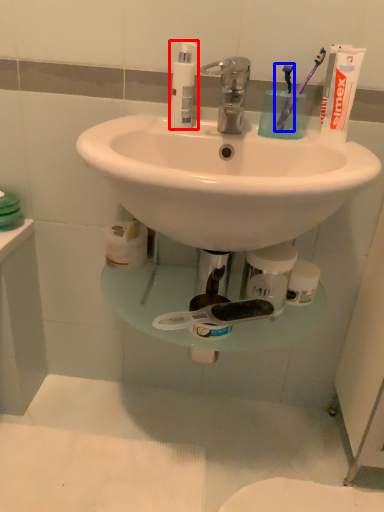
Question: Which object appears farthest to the camera in this image, soap dispenser (highlighted by a red box) or toothbrush (highlighted by a blue box)?

Choices:
 (A) soap dispenser
 (B) toothbrush

Answer: (B)